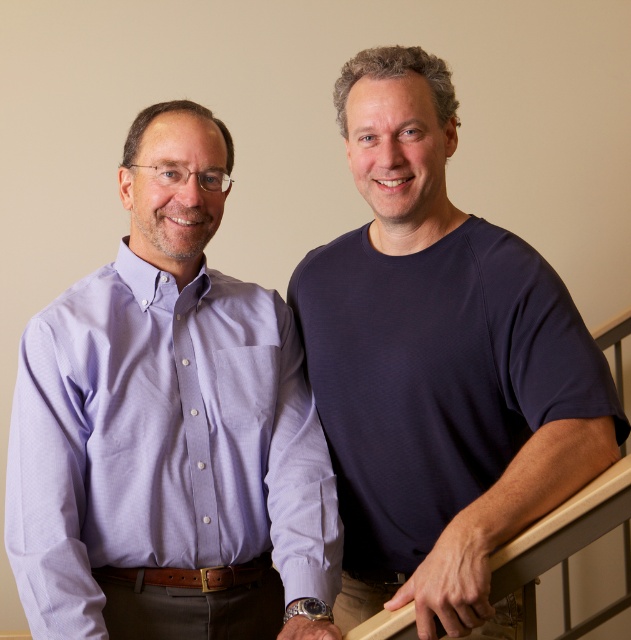
Which is below, lavender cotton shirt at left or dark blue t-shirt at upper right?

Positioned lower is lavender cotton shirt at left.

Between lavender cotton shirt at left and dark blue t-shirt at upper right, which one has more height?

dark blue t-shirt at upper right

Is point (281, 468) closer to viewer compared to point (485, 221)?

No, it is not.

Identify the location of lavender cotton shirt at left. (x=168, y=429).